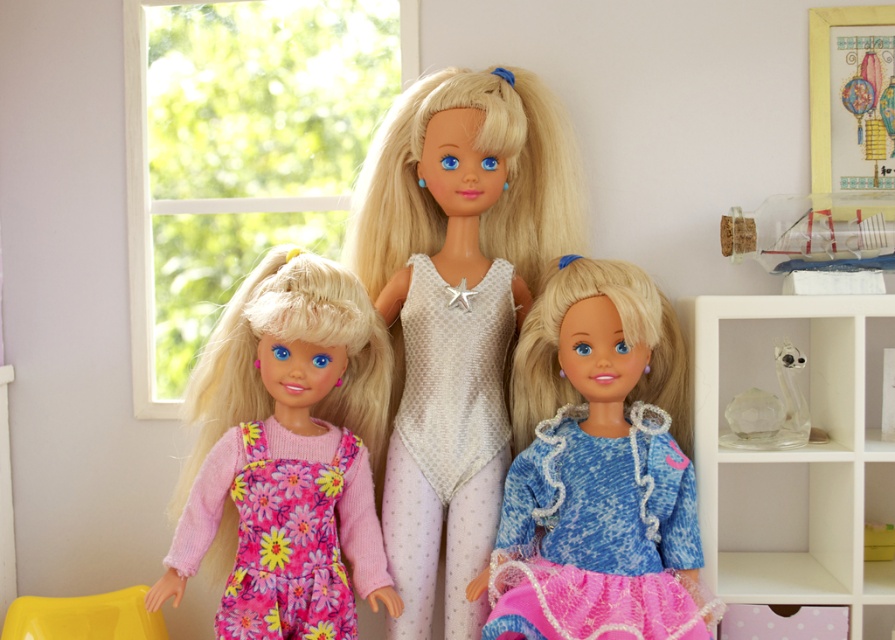
Question: Which object appears farthest from the camera in this image?

Choices:
 (A) blue knitted sweater at center
 (B) fluffy pink fabric dress at left

Answer: (B)

Question: Which point is farther from the camera taking this photo?

Choices:
 (A) (423, 248)
 (B) (292, 557)
 (C) (439, 291)
 (D) (337, 596)

Answer: (A)

Question: Observing the image, what is the correct spatial positioning of fluffy pink fabric dress at left in reference to blue knitted sweater at center?

Choices:
 (A) below
 (B) above

Answer: (B)

Question: Which is nearer to the fluffy pink fabric dress at left?

Choices:
 (A) white mesh bodysuit at center
 (B) blue knitted sweater at center

Answer: (A)

Question: Can you confirm if white dotted fabric dress at center is positioned to the left of white mesh bodysuit at center?

Choices:
 (A) no
 (B) yes

Answer: (A)

Question: Is white dotted fabric dress at center closer to the viewer compared to floral fabric dress at lower left?

Choices:
 (A) yes
 (B) no

Answer: (B)